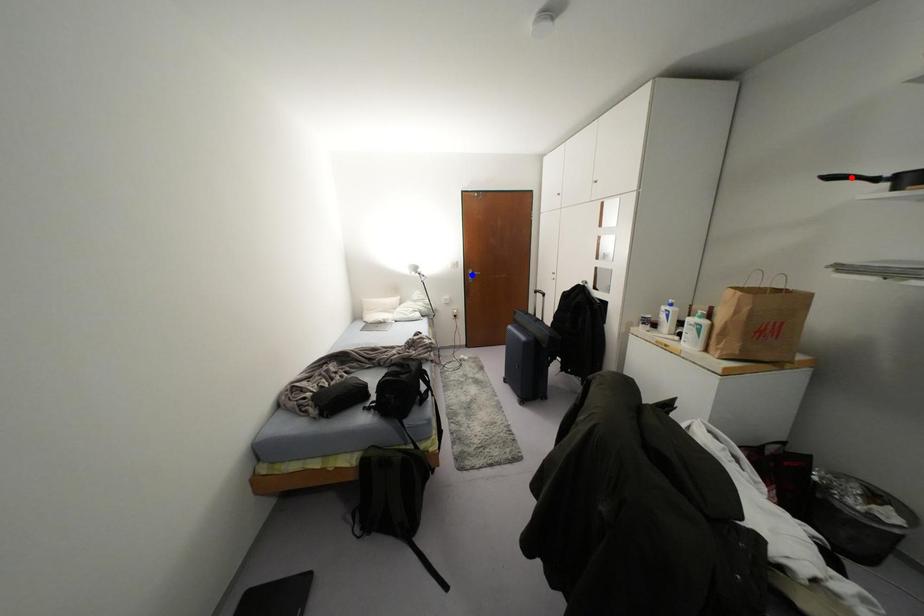
Question: Two points are marked on the image. Which point is closer to the camera?

Choices:
 (A) Blue point is closer.
 (B) Red point is closer.

Answer: (B)